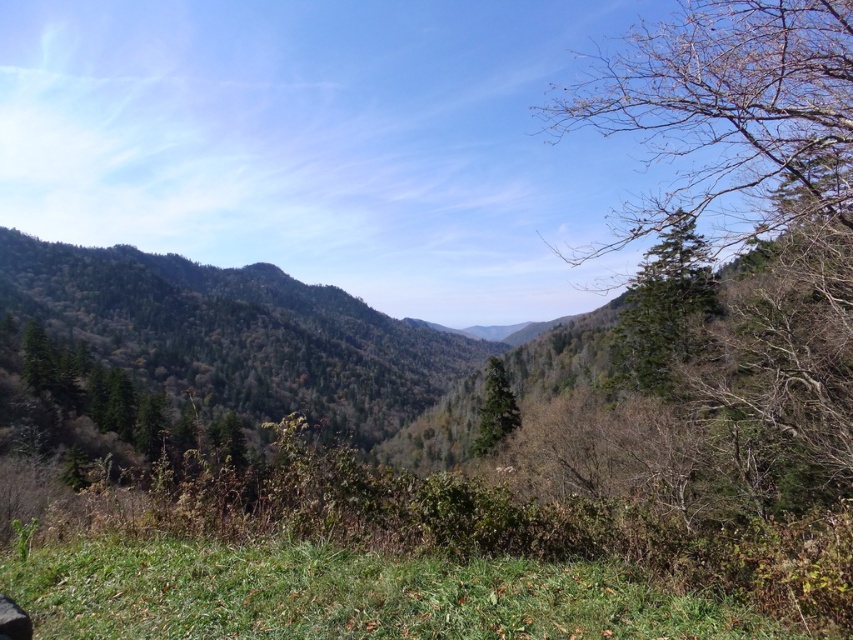
Question: Which is nearer to the green matte tree at upper right?

Choices:
 (A) green matte tree at center
 (B) bare branches at upper right

Answer: (A)

Question: Is bare branches at upper right smaller than green matte tree at upper right?

Choices:
 (A) yes
 (B) no

Answer: (B)

Question: Estimate the real-world distances between objects in this image. Which object is farther from the green matte tree at upper right?

Choices:
 (A) green matte tree at center
 (B) bare branches at upper right

Answer: (B)

Question: Which of the following is the farthest from the observer?

Choices:
 (A) bare branches at upper right
 (B) green matte tree at center
 (C) green matte tree at upper right

Answer: (B)

Question: Is the position of green matte tree at upper right more distant than that of green matte tree at center?

Choices:
 (A) yes
 (B) no

Answer: (B)

Question: Does bare branches at upper right appear on the right side of green matte tree at upper right?

Choices:
 (A) yes
 (B) no

Answer: (A)